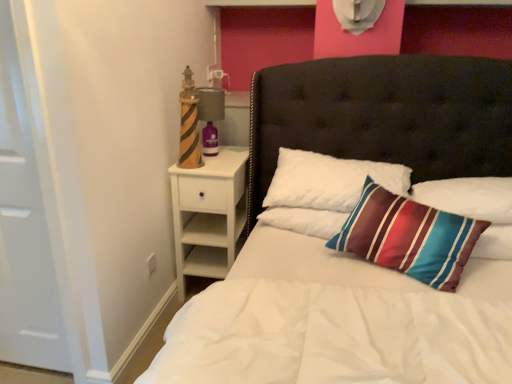
Describe the element at coordinates (475, 208) in the screenshot. I see `teal striped pillow at upper right, the 1th pillow from the right` at that location.

What is the approximate width of white matte door at left?

The width of white matte door at left is 3.32 inches.

The height and width of the screenshot is (384, 512). I want to click on white wood nightstand at left, so click(208, 214).

Describe the element at coordinates (384, 115) in the screenshot. This screenshot has height=384, width=512. I see `white quilted bed at center` at that location.

You are a GUI agent. You are given a task and a screenshot of the screen. Output one action in this format:
    pyautogui.click(x=<x>, y=<y>)
    Task: Click on the teal striped pillow at upper right, the 1th pillow from the right
    The width and height of the screenshot is (512, 384).
    Given the screenshot: What is the action you would take?
    pyautogui.click(x=475, y=208)

Which point is more distant from viewer, (202, 283) or (212, 93)?

Point (202, 283)

Who is smaller, white quilted bed at center or matte gray lamp at upper left?

With smaller size is matte gray lamp at upper left.

Is white quilted bed at center next to matte gray lamp at upper left and touching it?

They are not placed beside each other.

From the image's perspective, is white quilted bed at center below matte gray lamp at upper left?

Correct, white quilted bed at center appears lower than matte gray lamp at upper left in the image.

Is white wood nightstand at left next to matte gray lamp at upper left?

white wood nightstand at left and matte gray lamp at upper left are not in contact.

Which object is thinner, white wood nightstand at left or matte gray lamp at upper left?

Thinner between the two is matte gray lamp at upper left.

Which of these two, white wood nightstand at left or matte gray lamp at upper left, is bigger?

white wood nightstand at left.

Measure the distance between white matte door at left and white quilted pillow at center, the second pillow in the right-to-left sequence.

3.65 feet.

Where is `door to the left of white quilted pillow at center, the second pillow in the right-to-left sequence`? The height and width of the screenshot is (384, 512). door to the left of white quilted pillow at center, the second pillow in the right-to-left sequence is located at coordinates (27, 213).

Considering the relative sizes of white matte door at left and white quilted pillow at center, arranged as the 1th pillow when viewed from the left, in the image provided, is white matte door at left thinner than white quilted pillow at center, arranged as the 1th pillow when viewed from the left,?

Indeed, white matte door at left has a lesser width compared to white quilted pillow at center, arranged as the 1th pillow when viewed from the left.

Considering the relative positions of white matte door at left and white quilted pillow at center, the second pillow in the right-to-left sequence, in the image provided, is white matte door at left to the left of white quilted pillow at center, the second pillow in the right-to-left sequence, from the viewer's perspective?

Yes, white matte door at left is to the left of white quilted pillow at center, the second pillow in the right-to-left sequence.

Who is smaller, white matte door at left or teal striped pillow at upper right, the second pillow when ordered from left to right?

teal striped pillow at upper right, the second pillow when ordered from left to right.

From the image's perspective, between white matte door at left and teal striped pillow at upper right, the 1th pillow from the right, which one is located above?

white matte door at left is shown above in the image.

Is white wood nightstand at left placed right next to white quilted pillow at center, the second pillow in the right-to-left sequence?

white wood nightstand at left is not next to white quilted pillow at center, the second pillow in the right-to-left sequence, and they're not touching.

Is white wood nightstand at left wider or thinner than white quilted pillow at center, arranged as the 1th pillow when viewed from the left?

Clearly, white wood nightstand at left has more width compared to white quilted pillow at center, arranged as the 1th pillow when viewed from the left.

From the image's perspective, would you say white wood nightstand at left is positioned over white quilted pillow at center, arranged as the 1th pillow when viewed from the left?

No, from the image's perspective, white wood nightstand at left is not over white quilted pillow at center, arranged as the 1th pillow when viewed from the left.

Is white quilted bed at center touching white matte door at left?

They are not placed beside each other.

Considering their positions, is white quilted bed at center located in front of or behind white matte door at left?

white quilted bed at center is positioned closer to the viewer than white matte door at left.

Is white quilted bed at center oriented away from white matte door at left?

No.

How much distance is there between white quilted bed at center and white matte door at left?

white quilted bed at center and white matte door at left are 1.45 meters apart from each other.

Considering the relative sizes of white matte door at left and matte gray lamp at upper left in the image provided, is white matte door at left thinner than matte gray lamp at upper left?

Yes, white matte door at left is thinner than matte gray lamp at upper left.

Is matte gray lamp at upper left inside white matte door at left?

No, matte gray lamp at upper left is not surrounded by white matte door at left.

Between white matte door at left and matte gray lamp at upper left, which one is positioned behind?

matte gray lamp at upper left.

Consider the image. Is white matte door at left oriented away from matte gray lamp at upper left?

No, white matte door at left's orientation is not away from matte gray lamp at upper left.

The width and height of the screenshot is (512, 384). There is a white quilted bed at center. What are the coordinates of `lamp above it (from a real-world perspective)` in the screenshot? It's located at (210, 116).

Find the location of `nightstand below the matte gray lamp at upper left (from a real-world perspective)`. nightstand below the matte gray lamp at upper left (from a real-world perspective) is located at coordinates (208, 214).

Considering their positions, is white quilted pillow at center, arranged as the 1th pillow when viewed from the left, positioned further to white quilted bed at center than teal striped pillow at upper right, the 1th pillow from the right?

white quilted pillow at center, arranged as the 1th pillow when viewed from the left, lies further to white quilted bed at center than the other object.

Based on their spatial positions, is white quilted pillow at center, arranged as the 1th pillow when viewed from the left, or white matte door at left further from matte gray lamp at upper left?

Based on the image, white matte door at left appears to be further to matte gray lamp at upper left.

Based on their spatial positions, is teal striped pillow at upper right, the 1th pillow from the right, or matte gray lamp at upper left further from white matte door at left?

teal striped pillow at upper right, the 1th pillow from the right, is further to white matte door at left.

Which object lies further to the anchor point white quilted pillow at center, arranged as the 1th pillow when viewed from the left, white wood nightstand at left or white matte door at left?

Based on the image, white matte door at left appears to be further to white quilted pillow at center, arranged as the 1th pillow when viewed from the left.

Looking at the image, which one is located closer to white quilted pillow at center, arranged as the 1th pillow when viewed from the left, white wood nightstand at left or white quilted bed at center?

white wood nightstand at left is positioned closer to the anchor white quilted pillow at center, arranged as the 1th pillow when viewed from the left.

Considering their positions, is matte gray lamp at upper left positioned closer to white wood nightstand at left than white matte door at left?

matte gray lamp at upper left is positioned closer to the anchor white wood nightstand at left.

Considering their positions, is white quilted pillow at center, arranged as the 1th pillow when viewed from the left, positioned closer to white matte door at left than white quilted bed at center?

Based on the image, white quilted pillow at center, arranged as the 1th pillow when viewed from the left, appears to be nearer to white matte door at left.

From the image, which object appears to be farther from white wood nightstand at left, white quilted pillow at center, arranged as the 1th pillow when viewed from the left, or white quilted bed at center?

white quilted bed at center lies further to white wood nightstand at left than the other object.

You are a GUI agent. You are given a task and a screenshot of the screen. Output one action in this format:
    pyautogui.click(x=<x>, y=<y>)
    Task: Click on the nightstand located between matte gray lamp at upper left and teal striped pillow at upper right, the 1th pillow from the right, in the left-right direction
    
    Given the screenshot: What is the action you would take?
    pyautogui.click(x=208, y=214)

The height and width of the screenshot is (384, 512). I want to click on door positioned between white quilted bed at center and white quilted pillow at center, the second pillow in the right-to-left sequence, from near to far, so click(27, 213).

I want to click on nightstand between white quilted bed at center and matte gray lamp at upper left in the front-back direction, so click(208, 214).

Find the location of `pillow between white matte door at left and teal striped pillow at upper right, the 1th pillow from the right`. pillow between white matte door at left and teal striped pillow at upper right, the 1th pillow from the right is located at coordinates (305, 221).